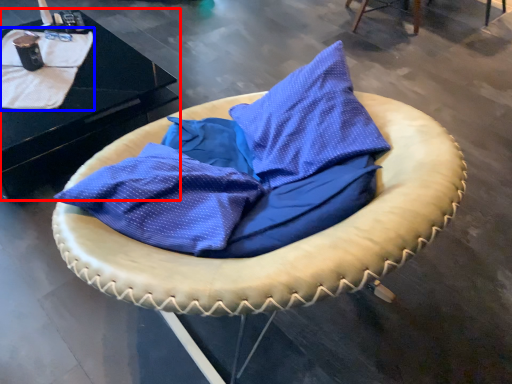
Question: Which object is closer to the camera taking this photo, table (highlighted by a red box) or blanket (highlighted by a blue box)?

Choices:
 (A) table
 (B) blanket

Answer: (A)